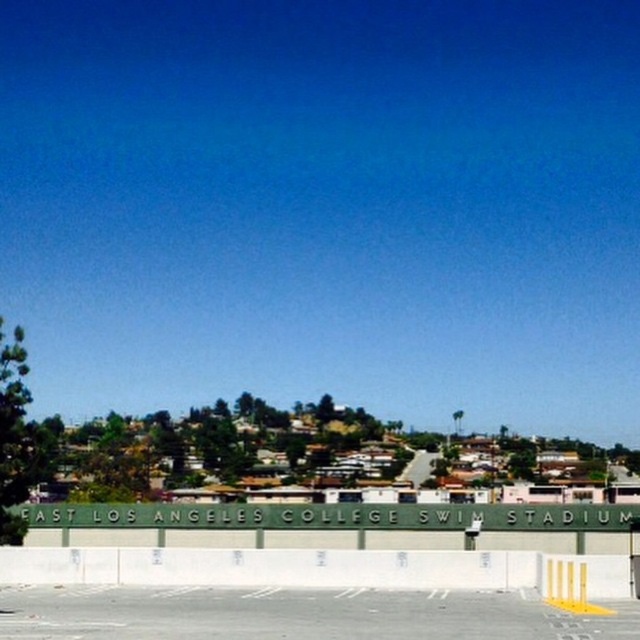
Question: Does gray asphalt parking lot at lower center appear on the left side of white concrete barrier at lower center?

Choices:
 (A) yes
 (B) no

Answer: (A)

Question: Among these points, which one is farthest from the camera?

Choices:
 (A) (605, 586)
 (B) (52, 634)

Answer: (A)

Question: Which point is farther from the camera taking this photo?

Choices:
 (A) (42, 595)
 (B) (312, 561)

Answer: (B)

Question: Where is gray asphalt parking lot at lower center located in relation to white concrete barrier at lower center in the image?

Choices:
 (A) right
 (B) left

Answer: (B)

Question: Is gray asphalt parking lot at lower center thinner than white concrete barrier at lower center?

Choices:
 (A) yes
 (B) no

Answer: (A)